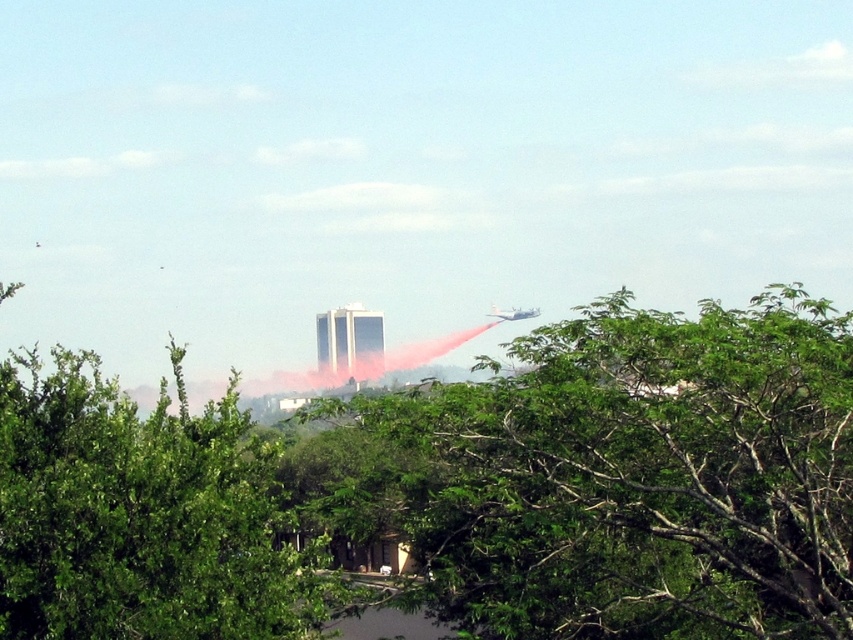
Is green leafy tree at center further to the viewer compared to metallic silver airplane at upper right?

No, green leafy tree at center is in front of metallic silver airplane at upper right.

Which is behind, point (401, 486) or point (492, 310)?

The point (492, 310) is behind.

Does point (412, 413) lie behind point (486, 314)?

No, (412, 413) is in front of (486, 314).

The image size is (853, 640). In order to click on green leafy tree at center in this screenshot , I will do `click(634, 476)`.